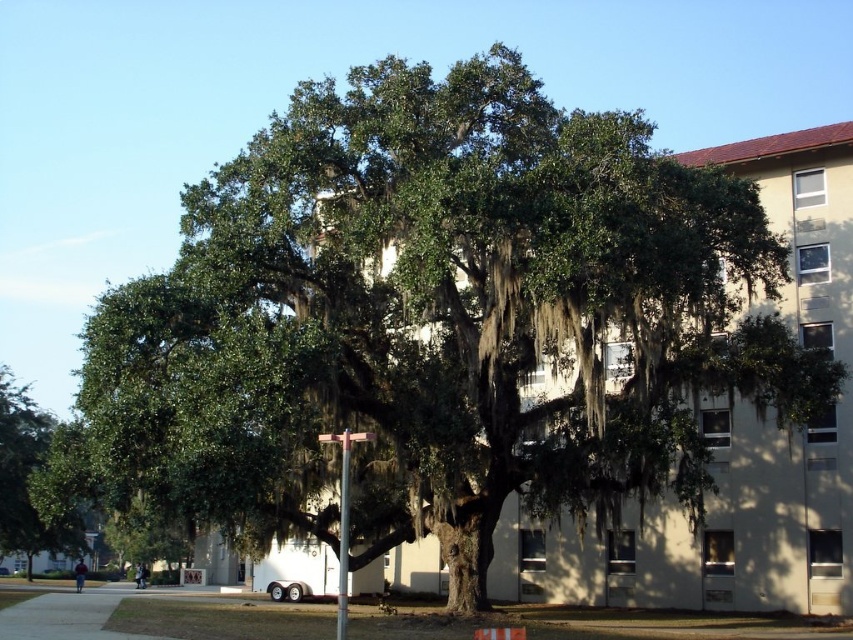
Question: Which point appears farthest from the camera in this image?

Choices:
 (A) (810, 628)
 (B) (4, 396)

Answer: (B)

Question: Can you confirm if green grass at lower center is positioned to the left of green leafy tree at lower left?

Choices:
 (A) no
 (B) yes

Answer: (A)

Question: Which point is closer to the camera taking this photo?

Choices:
 (A) (16, 522)
 (B) (442, 636)

Answer: (B)

Question: Where is green grass at lower center located in relation to green leafy tree at lower left in the image?

Choices:
 (A) right
 (B) left

Answer: (A)

Question: Is green grass at lower center further to the viewer compared to green leafy tree at lower left?

Choices:
 (A) no
 (B) yes

Answer: (A)